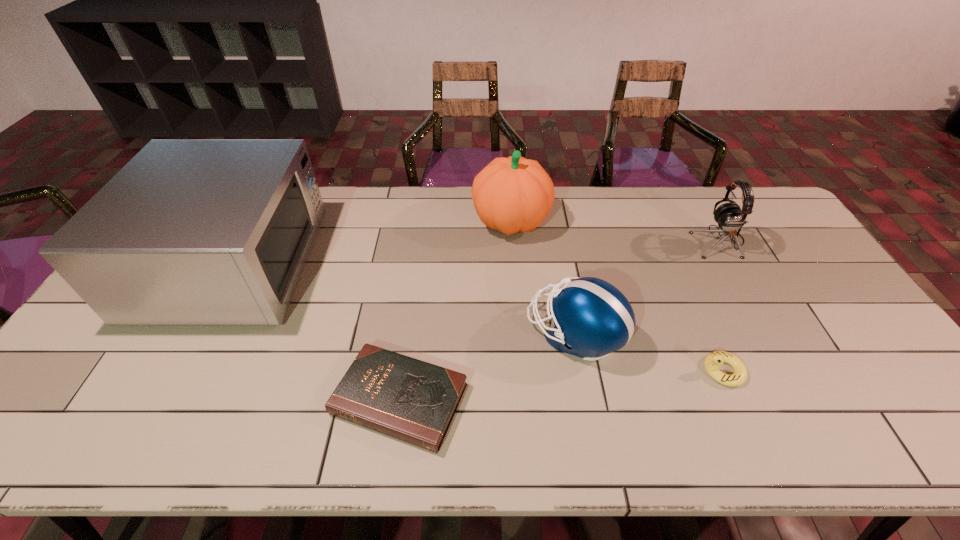
You are a GUI agent. You are given a task and a screenshot of the screen. Output one action in this format:
    pyautogui.click(x=<x>, y=<y>)
    Task: Click on the leftmost object
    
    Given the screenshot: What is the action you would take?
    pyautogui.click(x=189, y=232)

You are a GUI agent. You are given a task and a screenshot of the screen. Output one action in this format:
    pyautogui.click(x=<x>, y=<y>)
    Task: Click on the pumpkin
    The image size is (960, 540).
    Given the screenshot: What is the action you would take?
    pyautogui.click(x=514, y=194)

At what (x,y) coordinates should I click in order to perform the action: click on the third tallest object. Please return your answer as a coordinate pair (x, y). Looking at the image, I should click on (729, 216).

Image resolution: width=960 pixels, height=540 pixels. I want to click on earphone, so click(x=729, y=216).

Locate an element on the screen. The image size is (960, 540). the fourth tallest object is located at coordinates (592, 318).

Where is `duckling`? duckling is located at coordinates (713, 362).

Where is `the second shortest object`? The image size is (960, 540). the second shortest object is located at coordinates (713, 362).

The height and width of the screenshot is (540, 960). I want to click on the shortest object, so click(414, 401).

Locate an element on the screen. This screenshot has height=540, width=960. the second object from left to right is located at coordinates (414, 401).

Where is `vacant space located 0.110m with the door open on the microwave oven`? Image resolution: width=960 pixels, height=540 pixels. vacant space located 0.110m with the door open on the microwave oven is located at coordinates tap(347, 265).